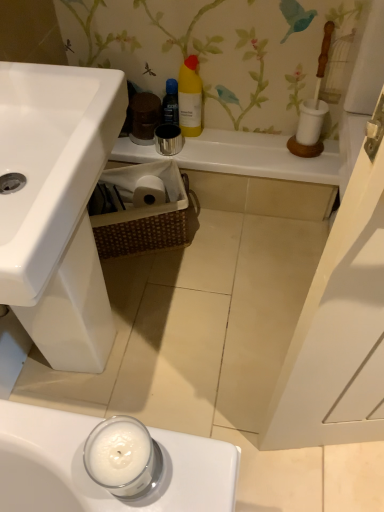
Image resolution: width=384 pixels, height=512 pixels. I want to click on vacant area on top of white ceramic counter top at upper center (from a real-world perspective), so click(x=239, y=143).